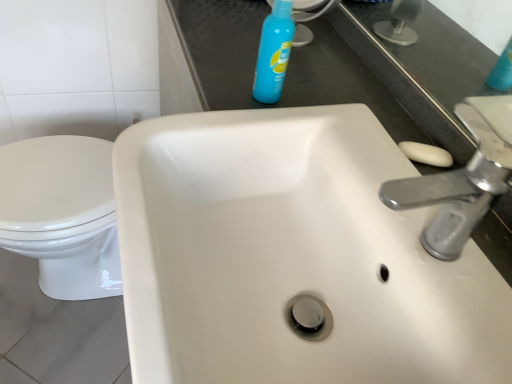
The image size is (512, 384). I want to click on vacant space situated above white glossy toilet at lower left (from a real-world perspective), so click(52, 168).